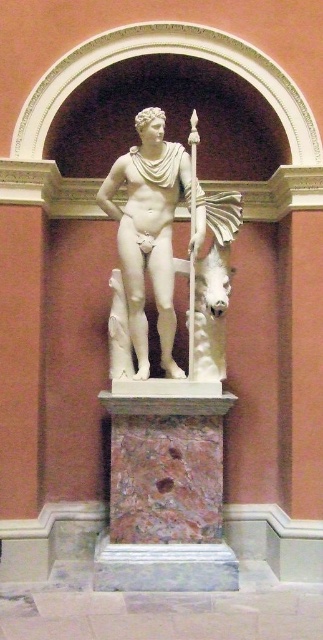
Does marble pedestal at center have a greater width compared to white marble statue at center?

Correct, the width of marble pedestal at center exceeds that of white marble statue at center.

Between marble pedestal at center and white marble statue at center, which one appears on the right side from the viewer's perspective?

marble pedestal at center is more to the right.

The image size is (323, 640). What do you see at coordinates (166, 496) in the screenshot?
I see `marble pedestal at center` at bounding box center [166, 496].

Image resolution: width=323 pixels, height=640 pixels. Find the location of `marble pedestal at center`. marble pedestal at center is located at coordinates (166, 496).